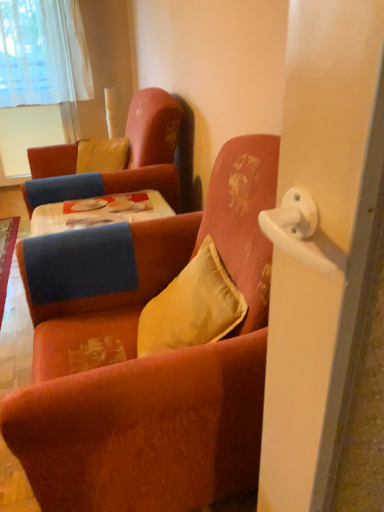
At what (x,y) coordinates should I click in order to perform the action: click on velvet orange armchair at center, the second chair positioned from the back. Please return your answer as a coordinate pair (x, y). The image size is (384, 512). Looking at the image, I should click on (146, 358).

Describe the element at coordinates (192, 307) in the screenshot. This screenshot has height=512, width=384. I see `satin yellow pillow at center, which ranks as the first pillow in right-to-left order` at that location.

Measure the distance between satin yellow pillow at center, placed as the first pillow when sorted from bottom to top, and camera.

3.87 feet.

Locate an element on the screen. The width and height of the screenshot is (384, 512). velvet orange armchair at center, the second chair positioned from the back is located at coordinates (146, 358).

Would you say white sheer curtain at upper left is inside or outside velvet orange armchair at upper left, positioned as the first chair in back-to-front order?

white sheer curtain at upper left exists outside the volume of velvet orange armchair at upper left, positioned as the first chair in back-to-front order.

From the image's perspective, which one is positioned lower, white sheer curtain at upper left or velvet orange armchair at upper left, the 2th chair in the front-to-back sequence?

velvet orange armchair at upper left, the 2th chair in the front-to-back sequence, is shown below in the image.

Does white sheer curtain at upper left have a larger size compared to velvet orange armchair at upper left, positioned as the first chair in back-to-front order?

No, white sheer curtain at upper left is not bigger than velvet orange armchair at upper left, positioned as the first chair in back-to-front order.

Which object is closer to the camera taking this photo, white sheer curtain at upper left or velvet orange armchair at upper left, positioned as the first chair in back-to-front order?

Positioned in front is velvet orange armchair at upper left, positioned as the first chair in back-to-front order.

From a real-world perspective, is yellow velvet pillow at upper left, which is counted as the 2th pillow, starting from the right, on velvet orange armchair at center, the second chair positioned from the back?

Indeed, from a real-world perspective, yellow velvet pillow at upper left, which is counted as the 2th pillow, starting from the right, stands above velvet orange armchair at center, the second chair positioned from the back.

From the image's perspective, is yellow velvet pillow at upper left, which is the 1th pillow from left to right, above or below velvet orange armchair at center, which is the first chair from front to back?

Based on their image positions, yellow velvet pillow at upper left, which is the 1th pillow from left to right, is located above velvet orange armchair at center, which is the first chair from front to back.

Is point (98, 163) closer to camera compared to point (251, 410)?

No, it is behind (251, 410).

From a real-world perspective, is velvet orange armchair at upper left, the 2th chair in the front-to-back sequence, physically below velvet orange armchair at center, which is the first chair from front to back?

Actually, velvet orange armchair at upper left, the 2th chair in the front-to-back sequence, is physically above velvet orange armchair at center, which is the first chair from front to back, in the real world.

Which is correct: velvet orange armchair at upper left, the 2th chair in the front-to-back sequence, is inside velvet orange armchair at center, the second chair positioned from the back, or outside of it?

velvet orange armchair at upper left, the 2th chair in the front-to-back sequence, is located beyond the bounds of velvet orange armchair at center, the second chair positioned from the back.

Is point (171, 153) closer to camera compared to point (231, 483)?

No, (171, 153) is further to viewer.

From the image's perspective, does velvet orange armchair at upper left, the 2th chair in the front-to-back sequence, appear lower than velvet orange armchair at center, the second chair positioned from the back?

No, from the image's perspective, velvet orange armchair at upper left, the 2th chair in the front-to-back sequence, is not below velvet orange armchair at center, the second chair positioned from the back.

From a real-world perspective, between velvet orange armchair at center, which is the first chair from front to back, and velvet orange armchair at upper left, positioned as the first chair in back-to-front order, who is vertically lower?

In real-world perspective, velvet orange armchair at center, which is the first chair from front to back, is lower.

Is point (248, 305) farther from camera compared to point (176, 132)?

That is False.

The image size is (384, 512). In order to click on chair behind the velvet orange armchair at center, which is the first chair from front to back in this screenshot , I will do `click(128, 160)`.

Could you measure the distance between velvet orange armchair at center, the second chair positioned from the back, and velvet orange armchair at upper left, positioned as the first chair in back-to-front order?

3.45 feet.

Is satin yellow pillow at center, placed as the first pillow when sorted from bottom to top, positioned with its back to velvet orange armchair at upper left, the 2th chair in the front-to-back sequence?

No, velvet orange armchair at upper left, the 2th chair in the front-to-back sequence, is not at the back of satin yellow pillow at center, placed as the first pillow when sorted from bottom to top.

Considering the relative positions of satin yellow pillow at center, positioned as the second pillow in top-to-bottom order, and velvet orange armchair at upper left, the 2th chair in the front-to-back sequence, in the image provided, is satin yellow pillow at center, positioned as the second pillow in top-to-bottom order, to the right of velvet orange armchair at upper left, the 2th chair in the front-to-back sequence, from the viewer's perspective?

Yes, satin yellow pillow at center, positioned as the second pillow in top-to-bottom order, is to the right of velvet orange armchair at upper left, the 2th chair in the front-to-back sequence.

Are satin yellow pillow at center, which ranks as the first pillow in right-to-left order, and velvet orange armchair at upper left, positioned as the first chair in back-to-front order, beside each other?

There is a gap between satin yellow pillow at center, which ranks as the first pillow in right-to-left order, and velvet orange armchair at upper left, positioned as the first chair in back-to-front order.

Considering the points (178, 257) and (40, 27), which point is behind, point (178, 257) or point (40, 27)?

The point (40, 27) is more distant.

Are velvet orange armchair at center, which is the first chair from front to back, and white sheer curtain at upper left beside each other?

velvet orange armchair at center, which is the first chair from front to back, and white sheer curtain at upper left are clearly separated.

Is velvet orange armchair at center, the second chair positioned from the back, positioned behind white sheer curtain at upper left?

No, velvet orange armchair at center, the second chair positioned from the back, is in front of white sheer curtain at upper left.

In terms of height, does velvet orange armchair at center, which is the first chair from front to back, look taller or shorter compared to white sheer curtain at upper left?

Clearly, velvet orange armchair at center, which is the first chair from front to back, is shorter compared to white sheer curtain at upper left.

Considering their positions, is white sheer curtain at upper left located in front of or behind yellow velvet pillow at upper left, the 2th pillow positioned from the front?

In the image, white sheer curtain at upper left appears behind yellow velvet pillow at upper left, the 2th pillow positioned from the front.

Who is bigger, white sheer curtain at upper left or yellow velvet pillow at upper left, the first pillow in the top-to-bottom sequence?

Bigger between the two is white sheer curtain at upper left.

Is white sheer curtain at upper left touching yellow velvet pillow at upper left, the first pillow in the top-to-bottom sequence?

white sheer curtain at upper left and yellow velvet pillow at upper left, the first pillow in the top-to-bottom sequence, are clearly separated.

This screenshot has height=512, width=384. What are the coordinates of `the 1st chair located beneath the white sheer curtain at upper left (from a real-world perspective)` in the screenshot? It's located at (128, 160).

What are the coordinates of `pillow lying on the left of velvet orange armchair at center, which is the first chair from front to back` in the screenshot? It's located at (102, 155).

Looking at the image, which one is located further to velvet orange armchair at upper left, positioned as the first chair in back-to-front order, white sheer curtain at upper left or yellow velvet pillow at upper left, which is counted as the 2th pillow, starting from the right?

The object further to velvet orange armchair at upper left, positioned as the first chair in back-to-front order, is white sheer curtain at upper left.

When comparing their distances from satin yellow pillow at center, acting as the 2th pillow starting from the left, does white sheer curtain at upper left or velvet orange armchair at center, which is the first chair from front to back, seem closer?

The object closer to satin yellow pillow at center, acting as the 2th pillow starting from the left, is velvet orange armchair at center, which is the first chair from front to back.

Looking at this image, considering their positions, is velvet orange armchair at center, which is the first chair from front to back, positioned closer to satin yellow pillow at center, placed as the first pillow when sorted from bottom to top, than yellow velvet pillow at upper left, the second pillow ordered from the bottom?

velvet orange armchair at center, which is the first chair from front to back, is positioned closer to the anchor satin yellow pillow at center, placed as the first pillow when sorted from bottom to top.

Based on their spatial positions, is satin yellow pillow at center, the first pillow from the front, or white sheer curtain at upper left further from velvet orange armchair at center, the second chair positioned from the back?

white sheer curtain at upper left is positioned further to the anchor velvet orange armchair at center, the second chair positioned from the back.

Which object lies further to the anchor point satin yellow pillow at center, placed as the first pillow when sorted from bottom to top, velvet orange armchair at upper left, the 2th chair in the front-to-back sequence, or white sheer curtain at upper left?

white sheer curtain at upper left is further to satin yellow pillow at center, placed as the first pillow when sorted from bottom to top.

Based on their spatial positions, is white sheer curtain at upper left or velvet orange armchair at upper left, the 2th chair in the front-to-back sequence, closer to velvet orange armchair at center, which is the first chair from front to back?

Based on the image, velvet orange armchair at upper left, the 2th chair in the front-to-back sequence, appears to be nearer to velvet orange armchair at center, which is the first chair from front to back.

Considering their positions, is yellow velvet pillow at upper left, the 2th pillow positioned from the front, positioned further to white sheer curtain at upper left than satin yellow pillow at center, marked as the second pillow in a back-to-front arrangement?

Based on the image, satin yellow pillow at center, marked as the second pillow in a back-to-front arrangement, appears to be further to white sheer curtain at upper left.

Consider the image. Looking at the image, which one is located closer to white sheer curtain at upper left, velvet orange armchair at center, the second chair positioned from the back, or satin yellow pillow at center, the first pillow from the front?

Based on the image, velvet orange armchair at center, the second chair positioned from the back, appears to be nearer to white sheer curtain at upper left.

Where is `pillow located between satin yellow pillow at center, the first pillow from the front, and white sheer curtain at upper left in the depth direction`? The width and height of the screenshot is (384, 512). pillow located between satin yellow pillow at center, the first pillow from the front, and white sheer curtain at upper left in the depth direction is located at coordinates (102, 155).

This screenshot has width=384, height=512. I want to click on pillow positioned between velvet orange armchair at center, the second chair positioned from the back, and yellow velvet pillow at upper left, which is the 1th pillow from left to right, from near to far, so click(x=192, y=307).

You are a GUI agent. You are given a task and a screenshot of the screen. Output one action in this format:
    pyautogui.click(x=<x>, y=<y>)
    Task: Click on the chair located between velvet orange armchair at center, the second chair positioned from the back, and white sheer curtain at upper left in the depth direction
    The height and width of the screenshot is (512, 384).
    Given the screenshot: What is the action you would take?
    pyautogui.click(x=128, y=160)

Where is `chair between satin yellow pillow at center, the first pillow from the front, and yellow velvet pillow at upper left, the 1th pillow from the back, in the front-back direction`? The width and height of the screenshot is (384, 512). chair between satin yellow pillow at center, the first pillow from the front, and yellow velvet pillow at upper left, the 1th pillow from the back, in the front-back direction is located at coordinates (128, 160).